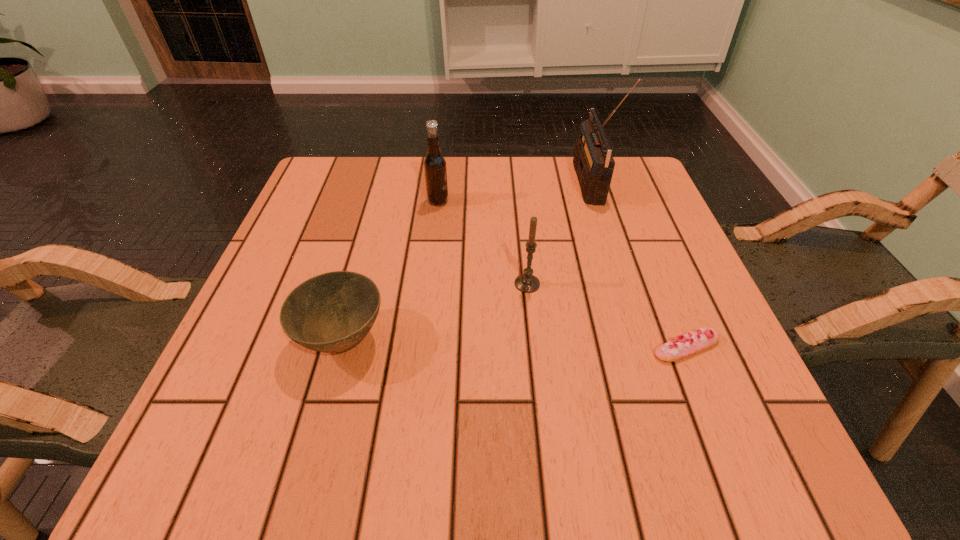
Where is `vacant region located on the front-facing side of the radio receiver`? The width and height of the screenshot is (960, 540). vacant region located on the front-facing side of the radio receiver is located at coordinates (512, 184).

In order to click on vacant space situated on the label of the root beer in this screenshot , I will do `click(551, 201)`.

The image size is (960, 540). I want to click on blank area located on the left of the candle, so click(x=464, y=284).

Find the location of a particular element. This screenshot has width=960, height=540. vacant space situated 0.290m on the back of the leftmost object is located at coordinates (377, 213).

This screenshot has height=540, width=960. Find the location of `vacant space located 0.140m on the back of the shortest object`. vacant space located 0.140m on the back of the shortest object is located at coordinates (658, 275).

The height and width of the screenshot is (540, 960). In order to click on radio receiver that is at the far edge in this screenshot , I will do `click(593, 161)`.

I want to click on root beer present at the far edge, so click(435, 170).

The width and height of the screenshot is (960, 540). What are the coordinates of `object positioned at the left edge` in the screenshot? It's located at (332, 312).

At what (x,y) coordinates should I click in order to perform the action: click on radio receiver situated at the right edge. Please return your answer as a coordinate pair (x, y). This screenshot has width=960, height=540. Looking at the image, I should click on (593, 161).

At what (x,y) coordinates should I click in order to perform the action: click on eclair present at the right edge. Please return your answer as a coordinate pair (x, y). The height and width of the screenshot is (540, 960). Looking at the image, I should click on (678, 348).